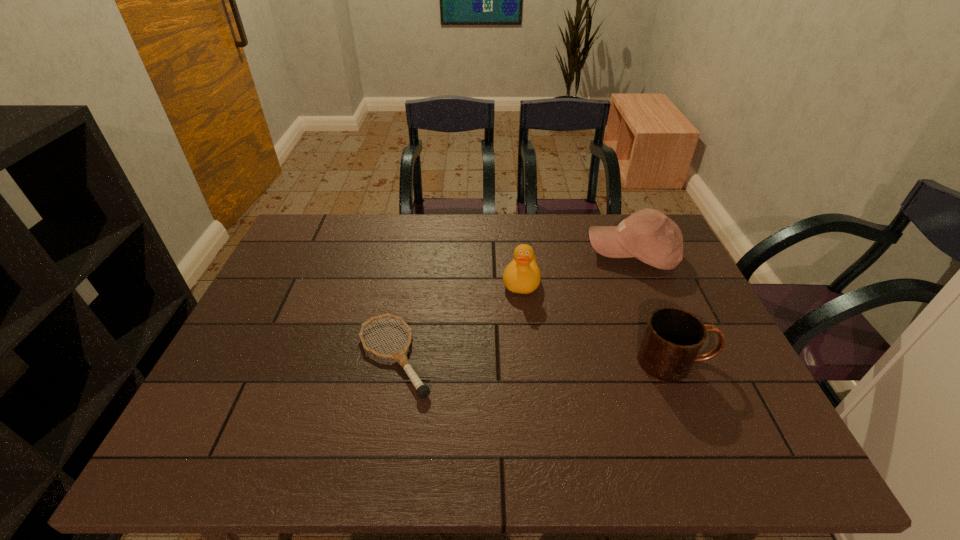
Locate an element on the screen. free region at the right edge of the desktop is located at coordinates (677, 294).

Locate an element on the screen. unoccupied position between the baseball cap and the mug is located at coordinates (655, 308).

Identify the location of free space between the baseball cap and the leftmost object. (514, 305).

Identify the location of free space between the mug and the baseball cap. (655, 308).

Where is `vacant space that is in between the mug and the baseball cap`? vacant space that is in between the mug and the baseball cap is located at coordinates pos(655,308).

Where is `blank region between the mug and the baseball cap`? The width and height of the screenshot is (960, 540). blank region between the mug and the baseball cap is located at coordinates (655, 308).

You are a GUI agent. You are given a task and a screenshot of the screen. Output one action in this format:
    pyautogui.click(x=<x>, y=<y>)
    Task: Click on the free point between the mug and the third object from right to left
    
    Given the screenshot: What is the action you would take?
    pyautogui.click(x=599, y=321)

This screenshot has height=540, width=960. What are the coordinates of `free space between the baseball cap and the tennis racket` in the screenshot? It's located at (514, 305).

Identify the location of vacant region between the mug and the second object from left to right. The image size is (960, 540). (599, 321).

At what (x,y) coordinates should I click in order to perform the action: click on free spot between the leftmost object and the mug. Please return your answer as a coordinate pair (x, y). The image size is (960, 540). Looking at the image, I should click on (536, 359).